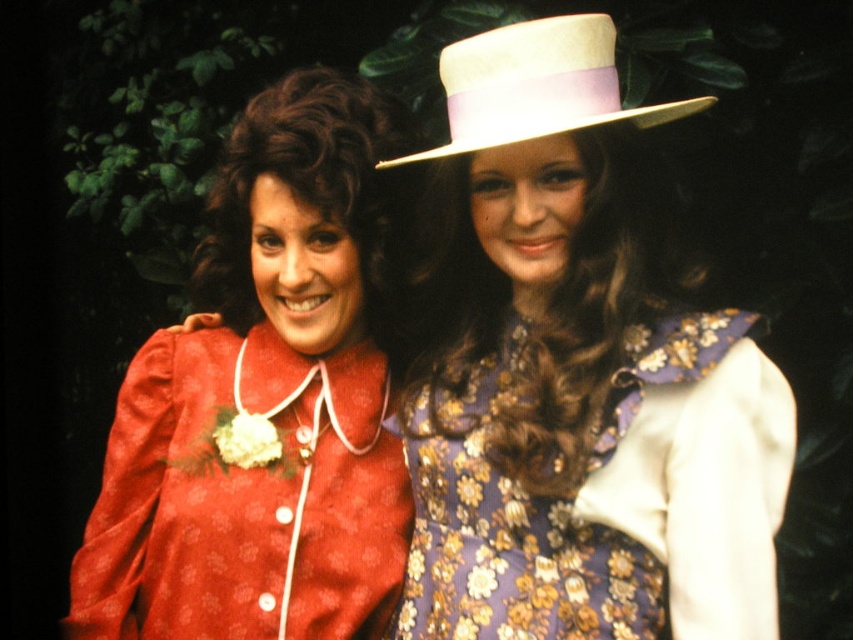
Consider the image. You are a photographer trying to capture the two women in the scene. You want to ensure both the matte red jacket at center and the white felt hat at upper center are clearly visible in the photo. Given their sizes, which object might require you to adjust your camera focus more carefully to ensure it doesn not get lost in the frame?

The white felt hat at upper center might require more careful focus adjustment since it is smaller than the matte red jacket at center and could be less prominent in the photo.

You are a photographer adjusting your camera settings to focus on the woman in the red jacket. You notice a point at coordinates [576,372]. Is this point located on the woman in the red jacket?

Yes, the point [576,372] is on the matte red jacket at center, so it is located on the woman in the red jacket.